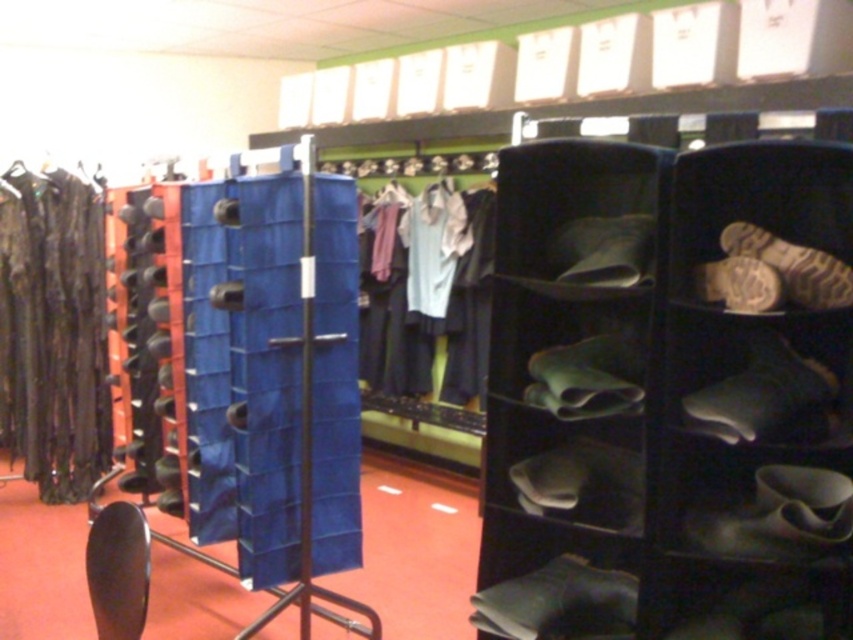
Question: Which point is farther to the camera?

Choices:
 (A) (x=460, y=332)
 (B) (x=492, y=320)

Answer: (A)

Question: Is black fabric shoe rack at right bigger than light blue fabric shirt at center?

Choices:
 (A) yes
 (B) no

Answer: (B)

Question: Can you confirm if black fabric shoe rack at right is positioned below shiny black dress at left?

Choices:
 (A) yes
 (B) no

Answer: (A)

Question: Which object appears closest to the camera in this image?

Choices:
 (A) light blue fabric shirt at center
 (B) black fabric shoe rack at right
 (C) shiny black dress at left

Answer: (B)

Question: Can you confirm if black fabric shoe rack at right is wider than light blue fabric shirt at center?

Choices:
 (A) yes
 (B) no

Answer: (A)

Question: Considering the real-world distances, which object is farthest from the shiny black dress at left?

Choices:
 (A) light blue fabric shirt at center
 (B) black fabric shoe rack at right

Answer: (B)